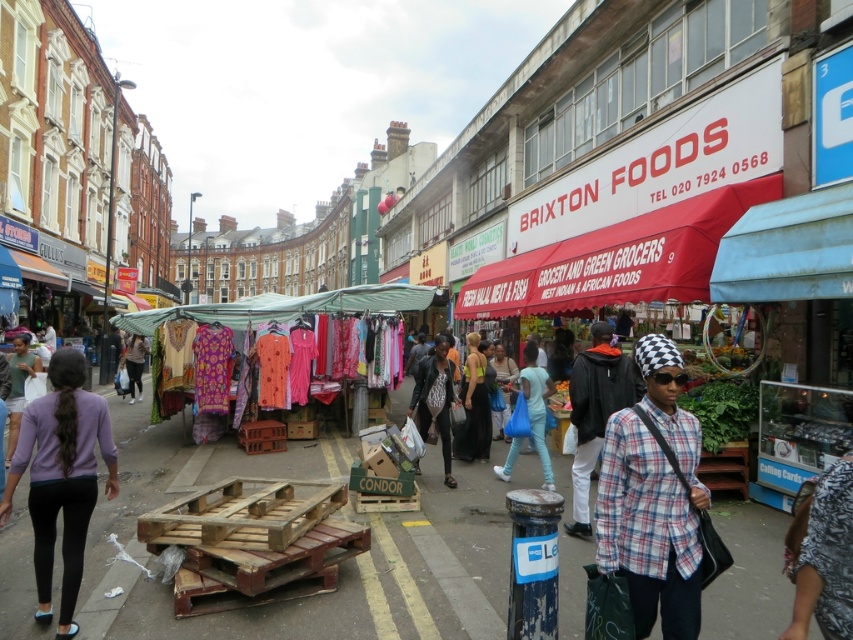
Question: Among these objects, which one is nearest to the camera?

Choices:
 (A) matte black pants at lower left
 (B) plaid cotton shirt at center
 (C) light blue fabric bag at center
 (D) matte black jacket at center

Answer: (B)

Question: Which of the following is the farthest from the observer?

Choices:
 (A) light blue fabric bag at center
 (B) leather jacket at center

Answer: (B)

Question: Observing the image, what is the correct spatial positioning of leather jacket at center in reference to matte black pants at lower left?

Choices:
 (A) below
 (B) above

Answer: (B)

Question: Does plaid cotton shirt at center appear over plaid shirt at center?

Choices:
 (A) no
 (B) yes

Answer: (B)

Question: Can you confirm if light blue fabric bag at center is bigger than light purple shirt at lower left?

Choices:
 (A) yes
 (B) no

Answer: (B)

Question: Which of the following is the farthest from the observer?

Choices:
 (A) plaid shirt at center
 (B) light purple shirt at lower left
 (C) light blue fabric bag at center
 (D) plaid cotton shirt at center

Answer: (C)